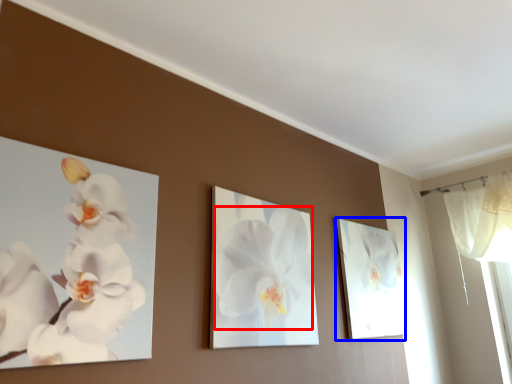
Question: Which point is further to the camera, flower (highlighted by a red box) or picture frame (highlighted by a blue box)?

Choices:
 (A) flower
 (B) picture frame

Answer: (B)